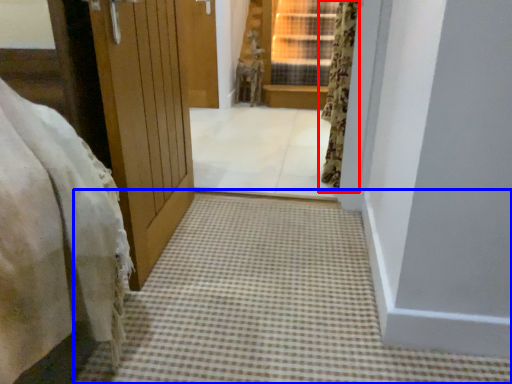
Question: Among these objects, which one is nearest to the camera, curtain (highlighted by a red box) or path (highlighted by a blue box)?

Choices:
 (A) curtain
 (B) path

Answer: (B)